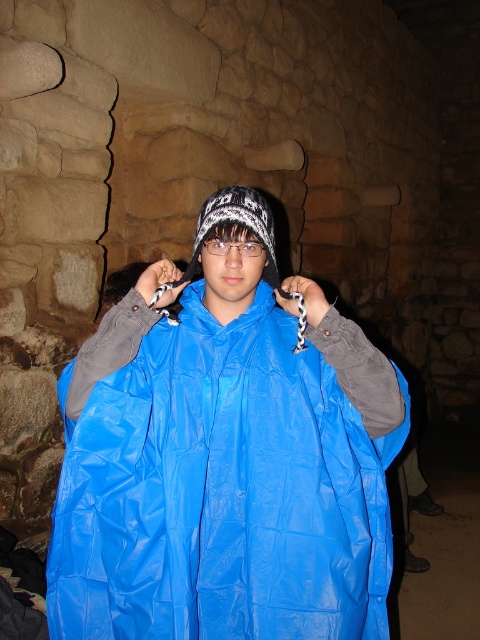
Can you confirm if blue shiny raincoat at center is shorter than white knitted hat at center?

In fact, blue shiny raincoat at center may be taller than white knitted hat at center.

Who is taller, blue shiny raincoat at center or white knitted hat at center?

With more height is blue shiny raincoat at center.

Looking at this image, measure the distance between blue shiny raincoat at center and camera.

4.02 feet

Identify the location of blue shiny raincoat at center. The height and width of the screenshot is (640, 480). (225, 456).